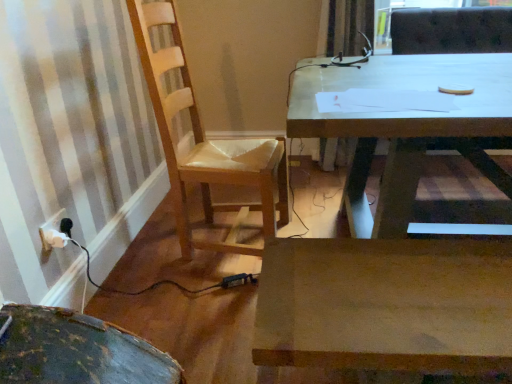
I want to click on wooden desk at center, so click(x=401, y=124).

Is white plastic electrical outlet at lower left not close to wooden desk at center?

Yes, white plastic electrical outlet at lower left and wooden desk at center are located far from each other.

Who is shorter, white plastic electrical outlet at lower left or wooden desk at center?

Standing shorter between the two is white plastic electrical outlet at lower left.

What's the angular difference between white plastic electrical outlet at lower left and wooden desk at center's facing directions?

The angle between the facing direction of white plastic electrical outlet at lower left and the facing direction of wooden desk at center is 91.2 degrees.

Considering the points (456, 57) and (232, 232), which point is behind, point (456, 57) or point (232, 232)?

The point (456, 57) is more distant.

Between wooden desk at center and wooden chair at left, which one has smaller size?

Smaller between the two is wooden chair at left.

Looking at this image, considering the sizes of objects wooden desk at center and wooden chair at left in the image provided, who is shorter, wooden desk at center or wooden chair at left?

wooden desk at center.

Can you tell me how much wooden desk at center and wooden chair at left differ in facing direction?

wooden desk at center and wooden chair at left are facing 86 degrees away from each other.

Is wooden chair at left with white plastic electrical outlet at lower left?

No, wooden chair at left is not making contact with white plastic electrical outlet at lower left.

Which of these two, wooden chair at left or white plastic electrical outlet at lower left, is wider?

With larger width is wooden chair at left.

Looking at the image, does wooden chair at left seem bigger or smaller compared to white plastic electrical outlet at lower left?

Clearly, wooden chair at left is larger in size than white plastic electrical outlet at lower left.

Is wooden desk at center at the left side of white plastic electrical outlet at lower left?

No, wooden desk at center is not to the left of white plastic electrical outlet at lower left.

From the image's perspective, which one is positioned lower, wooden desk at center or white plastic electrical outlet at lower left?

white plastic electrical outlet at lower left appears lower in the image.

Which is behind, point (323, 122) or point (42, 227)?

The point (42, 227) is farther.

From the image's perspective, which is below, wooden chair at left or wooden desk at center?

wooden desk at center.

Is wooden chair at left next to wooden desk at center and touching it?

No, wooden chair at left is not next to wooden desk at center.

From the picture: Between wooden chair at left and wooden desk at center, which one is positioned in front?

wooden desk at center is more forward.

From the picture: Is wooden chair at left aimed at wooden desk at center?

Yes, wooden chair at left faces towards wooden desk at center.

From a real-world perspective, is white plastic electrical outlet at lower left positioned above or below wooden chair at left?

white plastic electrical outlet at lower left is situated lower than wooden chair at left in the real world.

Do you think white plastic electrical outlet at lower left is within wooden chair at left, or outside of it?

A: white plastic electrical outlet at lower left lies outside wooden chair at left.

Is white plastic electrical outlet at lower left thinner than wooden chair at left?

Yes.

Locate an element on the screen. The height and width of the screenshot is (384, 512). electric outlet below the wooden chair at left (from the image's perspective) is located at coordinates (51, 227).

You are a GUI agent. You are given a task and a screenshot of the screen. Output one action in this format:
    pyautogui.click(x=<x>, y=<y>)
    Task: Click on the electric outlet on the left of the wooden desk at center
    The image size is (512, 384).
    Given the screenshot: What is the action you would take?
    pyautogui.click(x=51, y=227)

Where is `chair behind the wooden desk at center`? This screenshot has width=512, height=384. chair behind the wooden desk at center is located at coordinates tap(206, 143).

From the image, which object appears to be nearer to wooden desk at center, wooden chair at left or white plastic electrical outlet at lower left?

Based on the image, wooden chair at left appears to be nearer to wooden desk at center.

Considering their positions, is white plastic electrical outlet at lower left positioned closer to wooden chair at left than wooden desk at center?

The object closer to wooden chair at left is wooden desk at center.

Based on their spatial positions, is white plastic electrical outlet at lower left or wooden chair at left further from wooden desk at center?

The object further to wooden desk at center is white plastic electrical outlet at lower left.

From the image, which object appears to be nearer to wooden chair at left, wooden desk at center or white plastic electrical outlet at lower left?

wooden desk at center lies closer to wooden chair at left than the other object.

When comparing their distances from white plastic electrical outlet at lower left, does wooden chair at left or wooden desk at center seem closer?

wooden chair at left lies closer to white plastic electrical outlet at lower left than the other object.

From the image, which object appears to be nearer to white plastic electrical outlet at lower left, wooden desk at center or wooden chair at left?

wooden chair at left.

Identify the location of chair situated between white plastic electrical outlet at lower left and wooden desk at center from left to right. (206, 143).